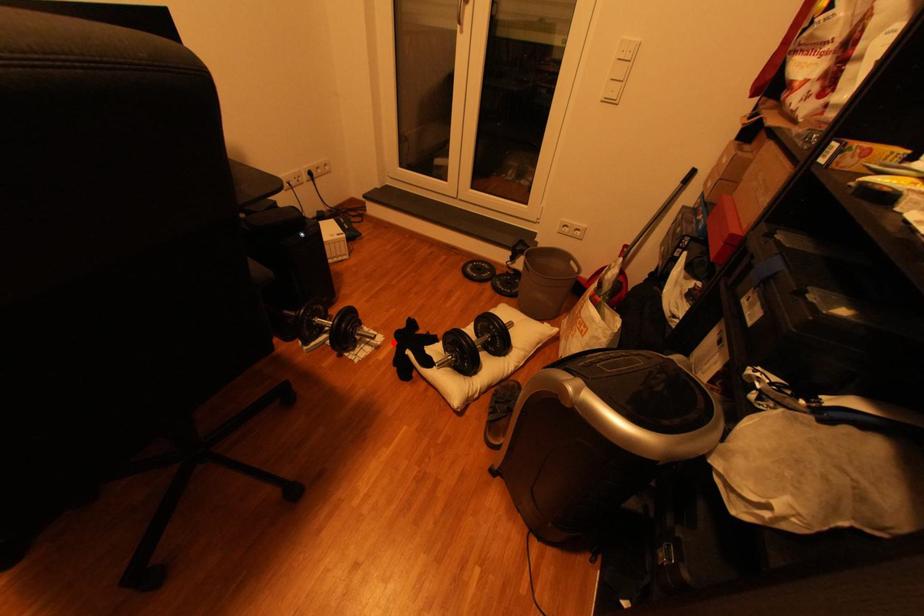
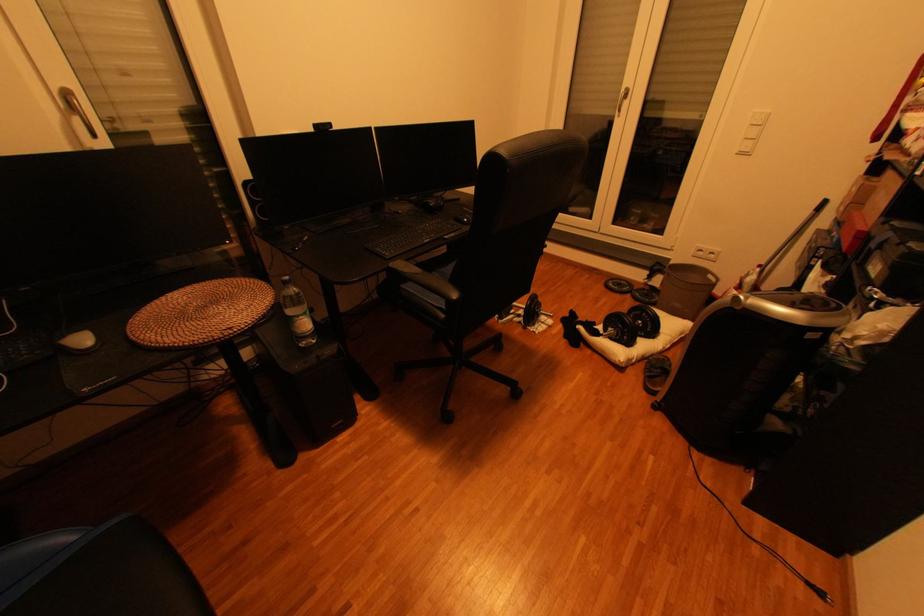
The point at the highlighted location is marked in the first image. Where is the corresponding point in the second image?

(564, 323)